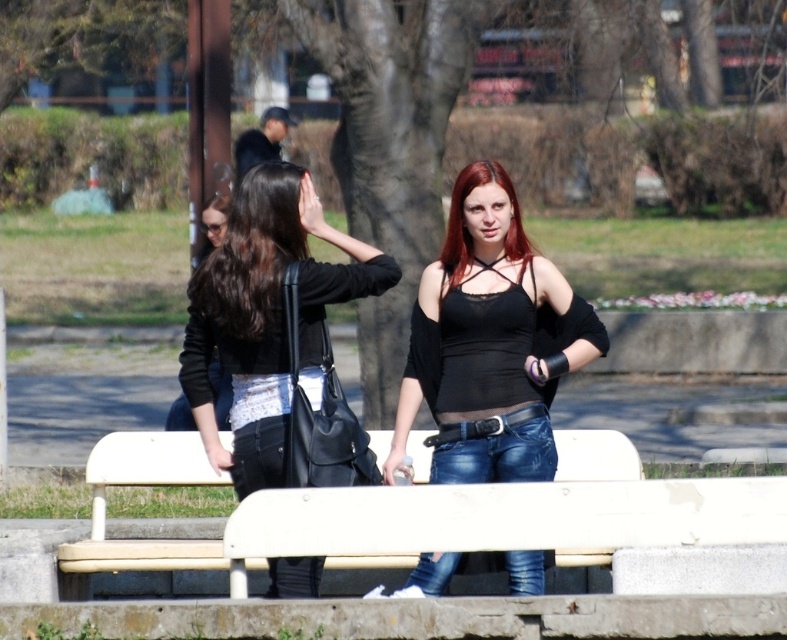
Can you confirm if dark brown silky hair at center is positioned to the left of dark red hair at center?

Correct, you'll find dark brown silky hair at center to the left of dark red hair at center.

What are the coordinates of `dark brown silky hair at center` in the screenshot? It's located at (252, 252).

Which is in front, point (246, 339) or point (516, 209)?

Point (246, 339) is more forward.

Identify the location of dark brown silky hair at center. This screenshot has width=787, height=640. (252, 252).

Can you confirm if black leather jacket at center is taller than dark brown silky hair at center?

Correct, black leather jacket at center is much taller as dark brown silky hair at center.

Is black leather jacket at center further to camera compared to dark brown silky hair at center?

That is False.

Image resolution: width=787 pixels, height=640 pixels. Describe the element at coordinates (265, 316) in the screenshot. I see `black leather jacket at center` at that location.

Find the location of a particular element. black leather jacket at center is located at coordinates (265, 316).

Is point (504, 397) closer to camera compared to point (198, 424)?

No, it is not.

Is black matte tank top at center further to camera compared to black leather jacket at center?

Yes, it is.

Is point (438, 417) closer to viewer compared to point (268, 260)?

No, it is not.

The image size is (787, 640). I want to click on black matte tank top at center, so click(490, 342).